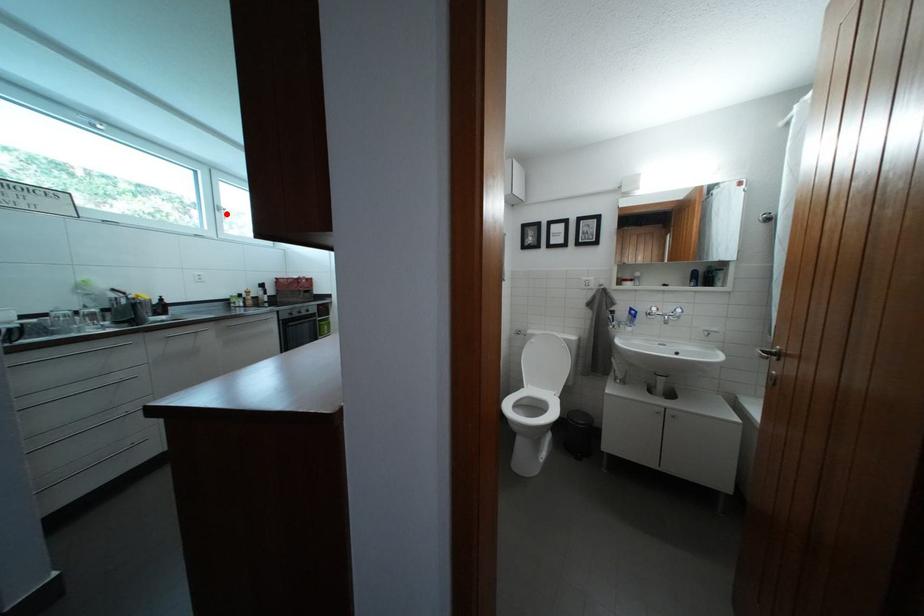
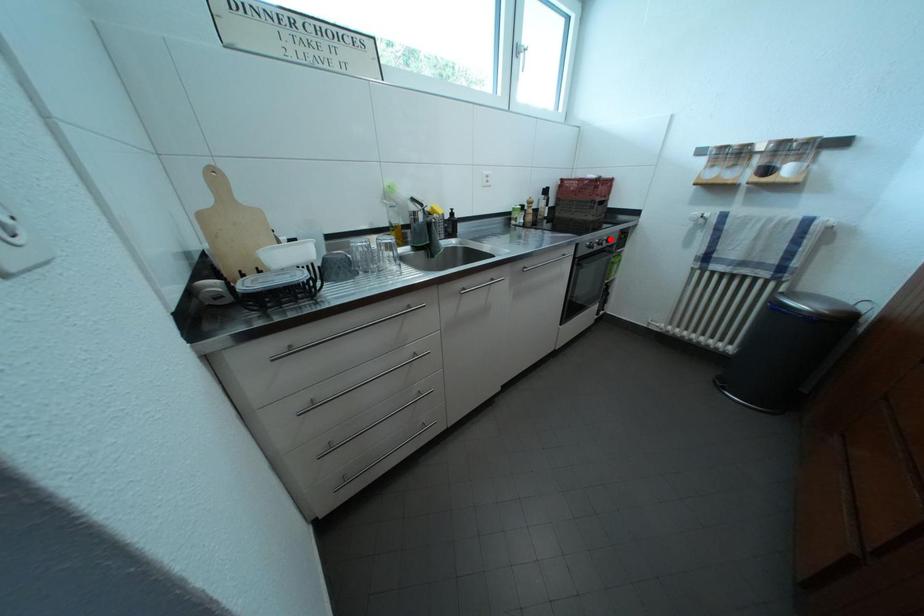
I am providing you with two images of the same scene from different viewpoints. A red point is marked on the first image and another point is marked on the second image. Are the points marked in image1 and image2 representing the same 3D position?

No